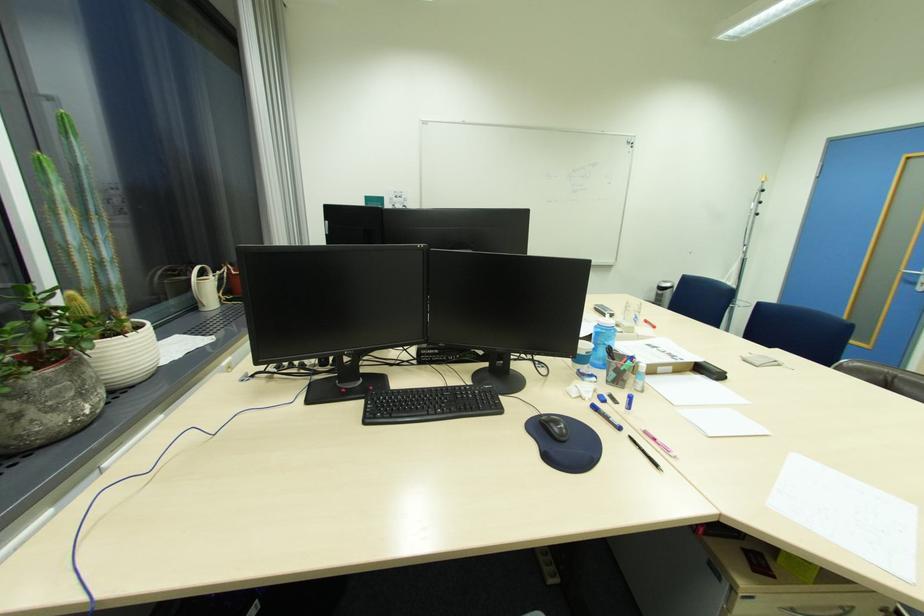
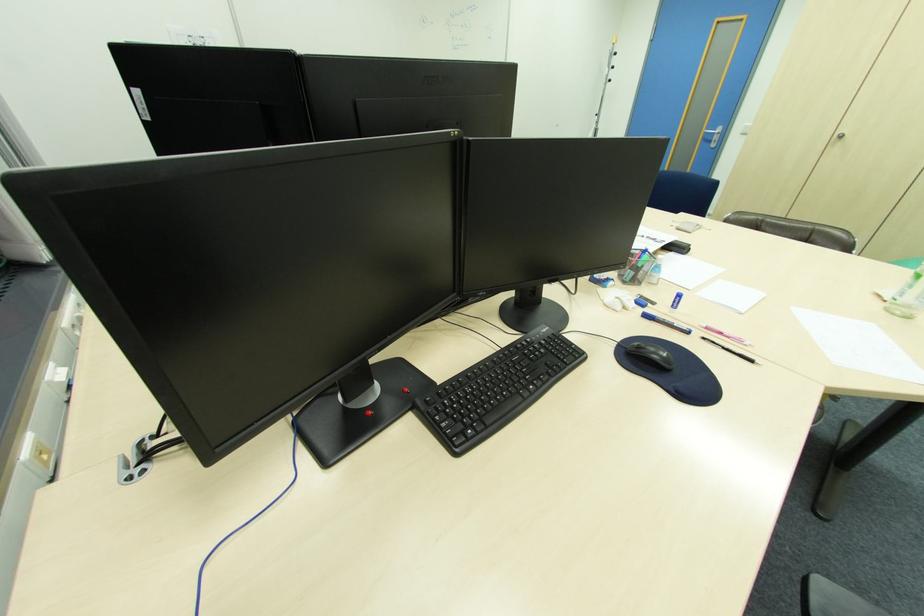
Find the pixel in the second image that matches (x=562, y=429) in the first image.

(662, 358)